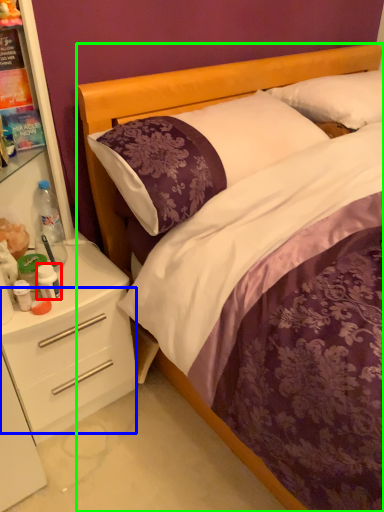
Question: Estimate the real-world distances between objects in this image. Which object is closer to bottle (highlighted by a red box), drawer (highlighted by a blue box) or bed (highlighted by a green box)?

Choices:
 (A) drawer
 (B) bed

Answer: (A)